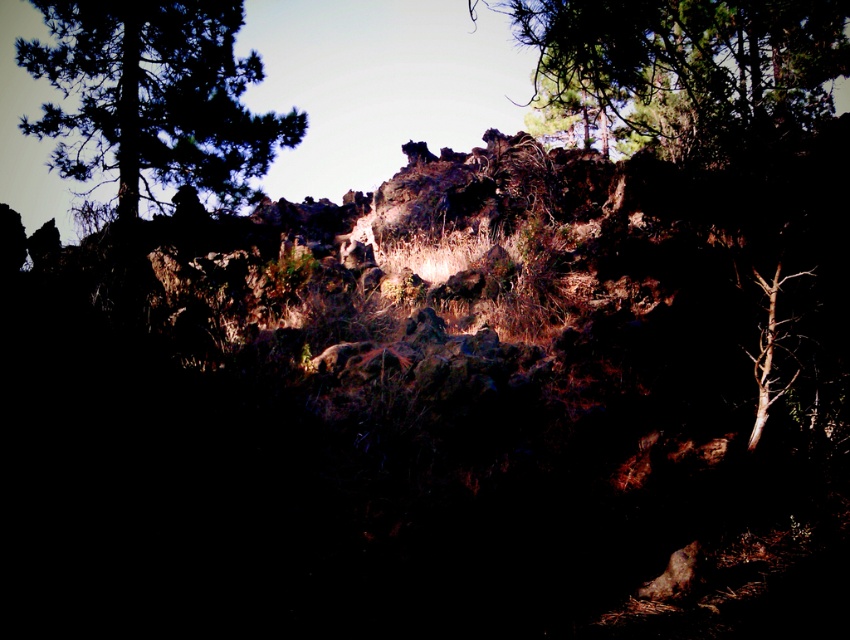
Question: Among these objects, which one is nearest to the camera?

Choices:
 (A) green leafy tree at upper center
 (B) green leafy tree at upper left
 (C) brown textured tree at center

Answer: (A)

Question: Is green leafy tree at upper left positioned at the back of green leafy tree at upper center?

Choices:
 (A) yes
 (B) no

Answer: (A)

Question: Which point is closer to the camera?

Choices:
 (A) (650, 80)
 (B) (667, 96)

Answer: (A)

Question: Does brown textured tree at center have a smaller size compared to green leafy tree at upper center?

Choices:
 (A) no
 (B) yes

Answer: (A)

Question: Considering the relative positions of green leafy tree at upper left and green leafy tree at upper center in the image provided, where is green leafy tree at upper left located with respect to green leafy tree at upper center?

Choices:
 (A) above
 (B) below

Answer: (B)

Question: Estimate the real-world distances between objects in this image. Which object is closer to the brown textured tree at center?

Choices:
 (A) green leafy tree at upper left
 (B) green leafy tree at upper center

Answer: (B)